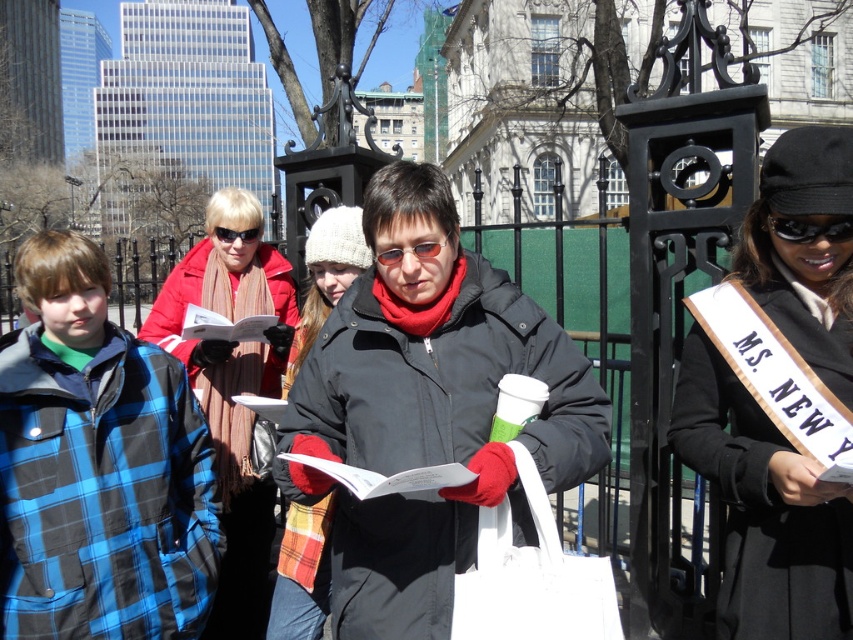
Who is positioned more to the left, red scarf at center or sunglasses at center?

From the viewer's perspective, red scarf at center appears more on the left side.

In order to click on red scarf at center in this screenshot , I will do `click(231, 392)`.

Identify the location of red scarf at center. The height and width of the screenshot is (640, 853). (231, 392).

In the scene shown: Does white matte bag at center have a greater width compared to sunglasses at center?

Indeed, white matte bag at center has a greater width compared to sunglasses at center.

Can you confirm if white matte bag at center is thinner than sunglasses at center?

In fact, white matte bag at center might be wider than sunglasses at center.

Who is more forward, (502, 621) or (381, 257)?

Point (502, 621) is in front.

What are the coordinates of `white matte bag at center` in the screenshot? It's located at (x=531, y=577).

Can you confirm if black plastic goggles at upper right is smaller than sunglasses at center?

Correct, black plastic goggles at upper right occupies less space than sunglasses at center.

Can you confirm if black plastic goggles at upper right is shorter than sunglasses at center?

Yes, black plastic goggles at upper right is shorter than sunglasses at center.

At what (x,y) coordinates should I click in order to perform the action: click on black plastic goggles at upper right. Please return your answer as a coordinate pair (x, y). Image resolution: width=853 pixels, height=640 pixels. Looking at the image, I should click on (809, 228).